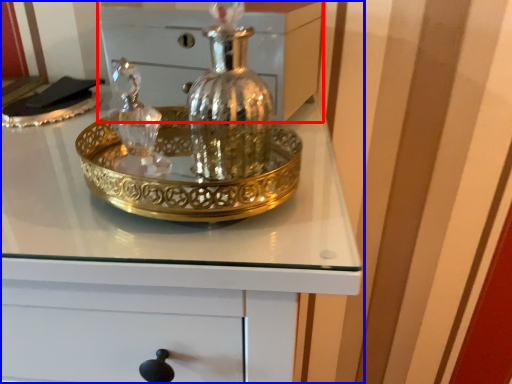
Question: Which object is further to the camera taking this photo, chest (highlighted by a red box) or chest of drawers (highlighted by a blue box)?

Choices:
 (A) chest
 (B) chest of drawers

Answer: (A)